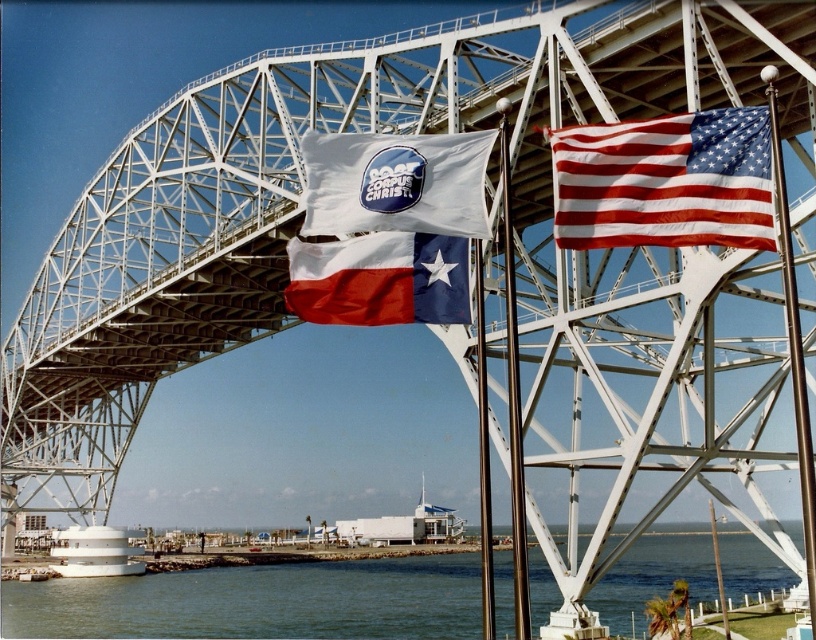
Can you confirm if green water at lower center is taller than white fabric flag at center?

Yes.

Where is `green water at lower center`? green water at lower center is located at coordinates (258, 602).

Locate an element on the screen. The width and height of the screenshot is (816, 640). green water at lower center is located at coordinates (258, 602).

Which is more to the left, green water at lower center or american flag at upper right?

american flag at upper right

Is green water at lower center behind american flag at upper right?

Yes, green water at lower center is behind american flag at upper right.

Does point (635, 624) come in front of point (592, 204)?

No.

The image size is (816, 640). In order to click on green water at lower center in this screenshot , I will do `click(258, 602)`.

Is american flag at upper right below red-white-blue fabric texas flag at center?

Incorrect, american flag at upper right is not positioned below red-white-blue fabric texas flag at center.

Who is lower down, american flag at upper right or red-white-blue fabric texas flag at center?

red-white-blue fabric texas flag at center is below.

Is point (621, 132) closer to viewer compared to point (370, 278)?

Yes, point (621, 132) is in front of point (370, 278).

Identify the location of american flag at upper right. The image size is (816, 640). (664, 180).